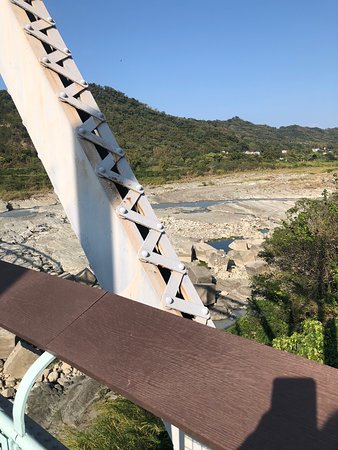
You are a GUI agent. You are given a task and a screenshot of the screen. Output one action in this format:
    pyautogui.click(x=<x>, y=<y>)
    Task: Click on the wood plank
    The image size is (338, 450).
    Given the screenshot: What is the action you would take?
    pyautogui.click(x=73, y=298), pyautogui.click(x=116, y=352)